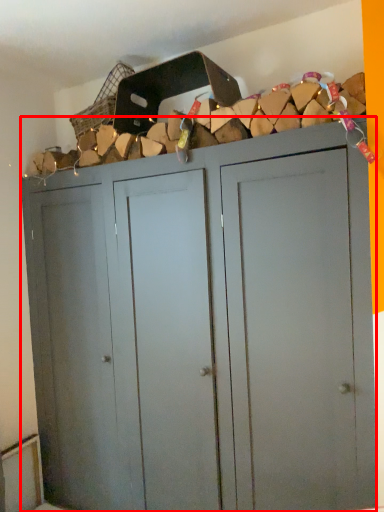
Question: In this image, where is cupboard (annotated by the red box) located relative to basket?

Choices:
 (A) right
 (B) left

Answer: (A)